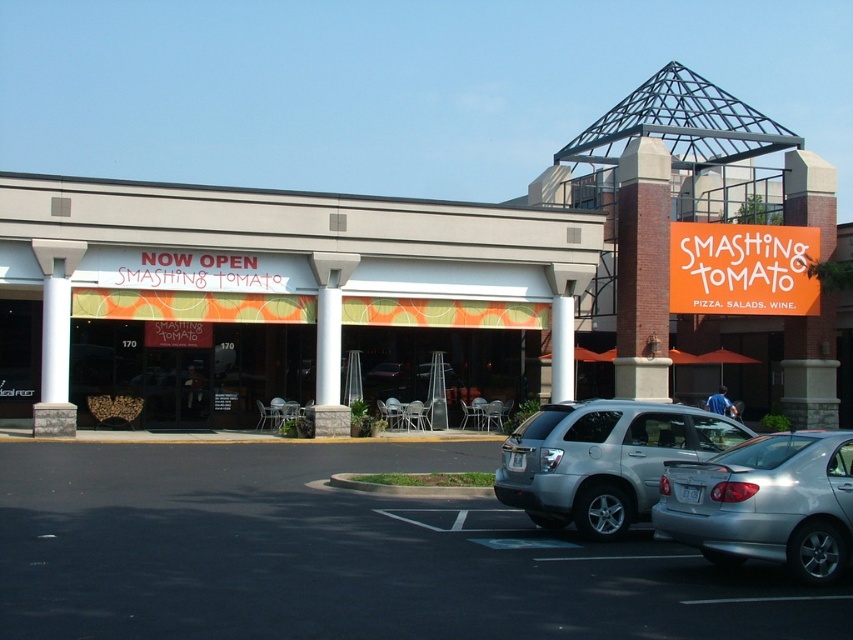
Is silver metallic sedan at lower right thinner than orange plastic sign at upper center?

Yes, silver metallic sedan at lower right is thinner than orange plastic sign at upper center.

The width and height of the screenshot is (853, 640). What are the coordinates of `silver metallic sedan at lower right` in the screenshot? It's located at (764, 502).

Find the location of a particular element. The height and width of the screenshot is (640, 853). silver metallic sedan at lower right is located at coordinates (764, 502).

Is silver metallic sedan at lower right below silver metallic suv at lower right?

Correct, silver metallic sedan at lower right is located below silver metallic suv at lower right.

Can you confirm if silver metallic sedan at lower right is positioned to the left of silver metallic suv at lower right?

Incorrect, silver metallic sedan at lower right is not on the left side of silver metallic suv at lower right.

Is point (762, 436) positioned after point (744, 435)?

No, it is in front of (744, 435).

Where is `silver metallic sedan at lower right`? The image size is (853, 640). silver metallic sedan at lower right is located at coordinates (764, 502).

Can you confirm if black asphalt parking lot at lower left is positioned to the right of orange plastic sign at upper center?

No, black asphalt parking lot at lower left is not to the right of orange plastic sign at upper center.

Is point (758, 604) less distant than point (799, 280)?

Yes, it is in front of point (799, 280).

Locate an element on the screen. The image size is (853, 640). black asphalt parking lot at lower left is located at coordinates (341, 556).